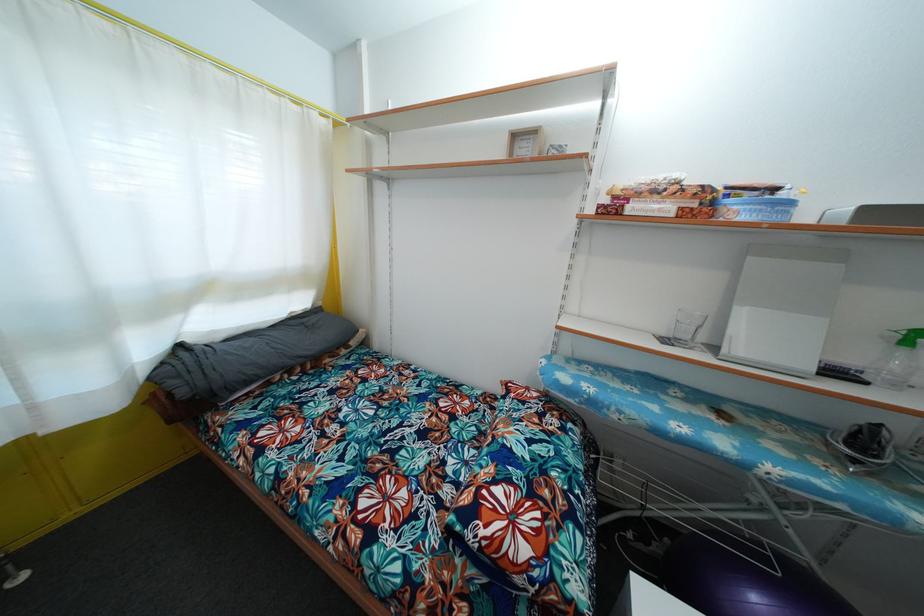
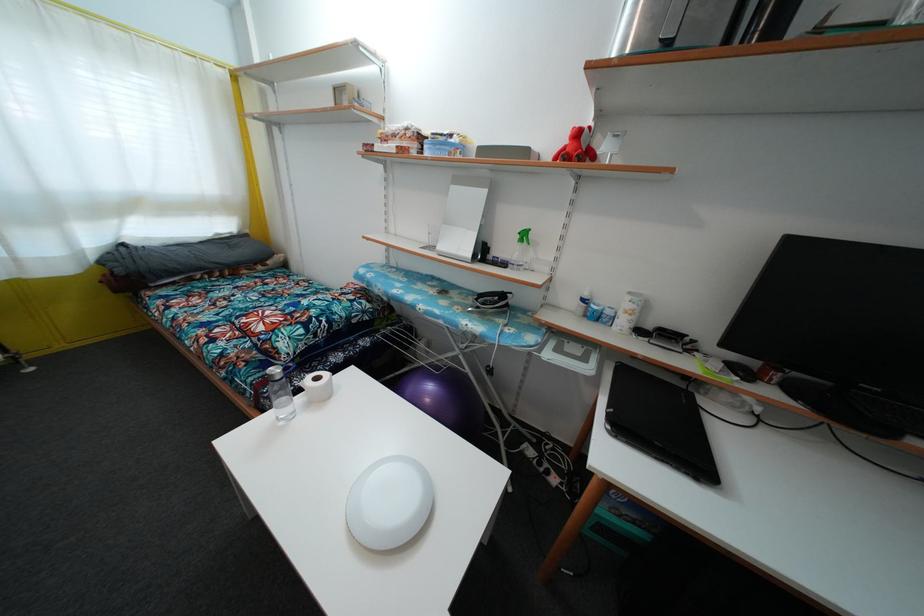
Locate, in the second image, the point that corresponds to point (777, 430) in the first image.

(475, 304)